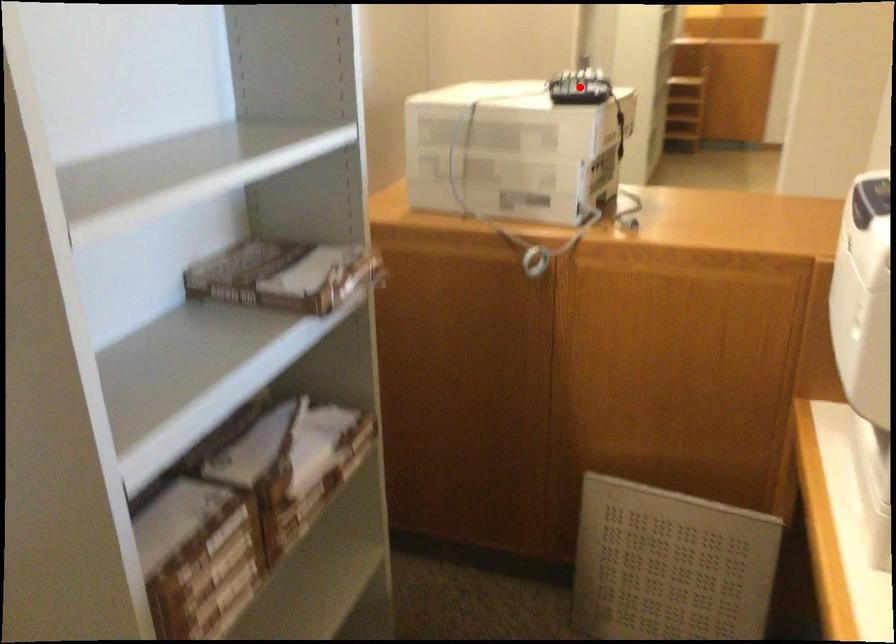
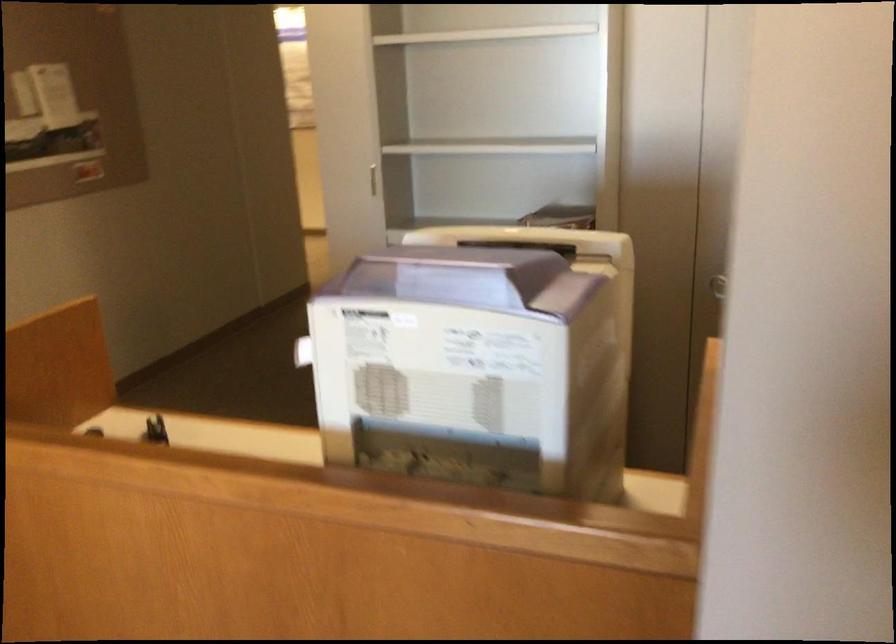
Question: I am providing you with two images of the same scene from different viewpoints. A red point is marked on the first image. At the location where the point appears in image 1, is it still visible in image 2?

Choices:
 (A) Yes
 (B) No

Answer: (B)